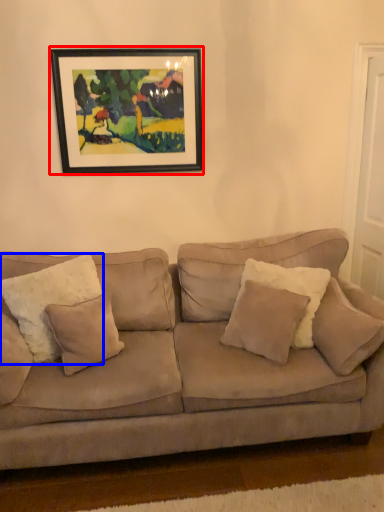
Question: Which point is further to the camera, picture frame (highlighted by a red box) or pillow (highlighted by a blue box)?

Choices:
 (A) picture frame
 (B) pillow

Answer: (A)